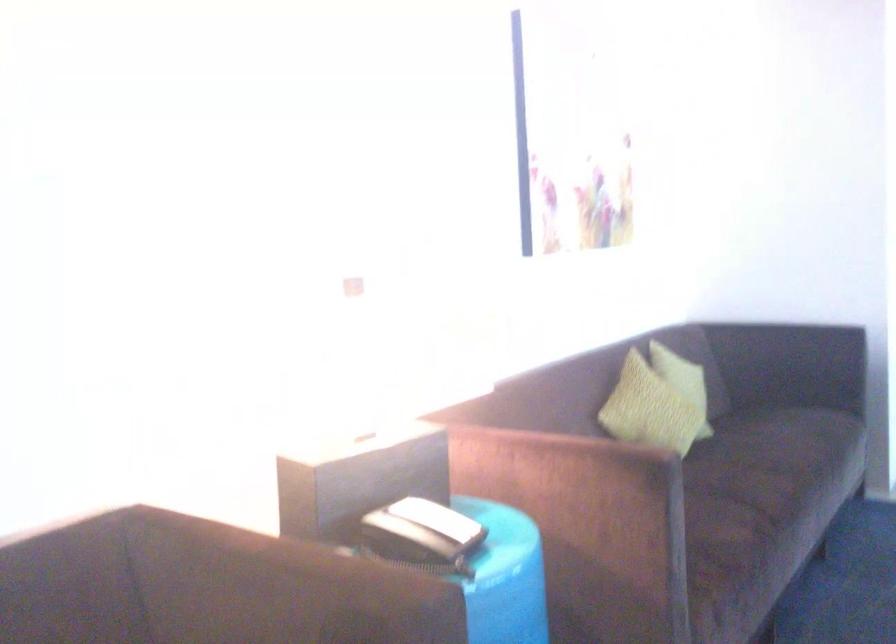
Find the location of a particular element. The image size is (896, 644). dark sofa sitting surface is located at coordinates (768, 489).